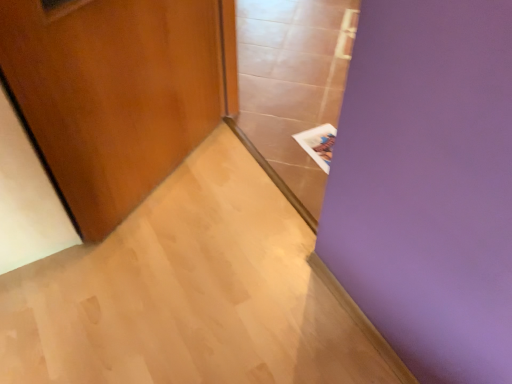
Question: Does transparent glass door at center have a greater height compared to wooden door at left?

Choices:
 (A) no
 (B) yes

Answer: (B)

Question: Is transparent glass door at center shorter than wooden door at left?

Choices:
 (A) no
 (B) yes

Answer: (A)

Question: Would you say transparent glass door at center is outside wooden door at left?

Choices:
 (A) no
 (B) yes

Answer: (B)

Question: Considering the relative positions of transparent glass door at center and wooden door at left in the image provided, is transparent glass door at center to the left of wooden door at left from the viewer's perspective?

Choices:
 (A) no
 (B) yes

Answer: (A)

Question: Is transparent glass door at center turned away from wooden door at left?

Choices:
 (A) yes
 (B) no

Answer: (A)

Question: Is point (300, 142) closer or farther from the camera than point (205, 127)?

Choices:
 (A) farther
 (B) closer

Answer: (B)

Question: In the image, is white paper at upper right on the left side or the right side of wooden door at left?

Choices:
 (A) left
 (B) right

Answer: (B)

Question: From their relative heights in the image, would you say white paper at upper right is taller or shorter than wooden door at left?

Choices:
 (A) tall
 (B) short

Answer: (B)

Question: Considering the positions of white paper at upper right and wooden door at left in the image, is white paper at upper right bigger or smaller than wooden door at left?

Choices:
 (A) big
 (B) small

Answer: (B)

Question: Visually, is wooden door at left positioned to the left or to the right of white paper at upper right?

Choices:
 (A) right
 (B) left

Answer: (B)

Question: Choose the correct answer: Is wooden door at left inside white paper at upper right or outside it?

Choices:
 (A) inside
 (B) outside

Answer: (B)

Question: In the image, is wooden door at left positioned in front of or behind white paper at upper right?

Choices:
 (A) front
 (B) behind

Answer: (A)

Question: Is wooden door at left wider or thinner than white paper at upper right?

Choices:
 (A) thin
 (B) wide

Answer: (A)

Question: Based on their sizes in the image, would you say white paper at upper right is bigger or smaller than transparent glass door at center?

Choices:
 (A) big
 (B) small

Answer: (B)

Question: From the image's perspective, is white paper at upper right located above or below transparent glass door at center?

Choices:
 (A) above
 (B) below

Answer: (B)